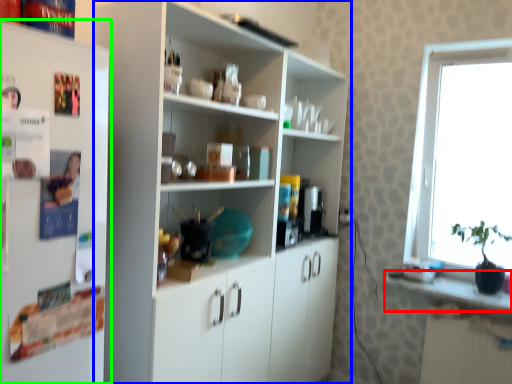
Question: Which is farther away from counter top (highlighted by a red box)? cupboard (highlighted by a blue box) or refrigerator (highlighted by a green box)?

Choices:
 (A) cupboard
 (B) refrigerator

Answer: (B)